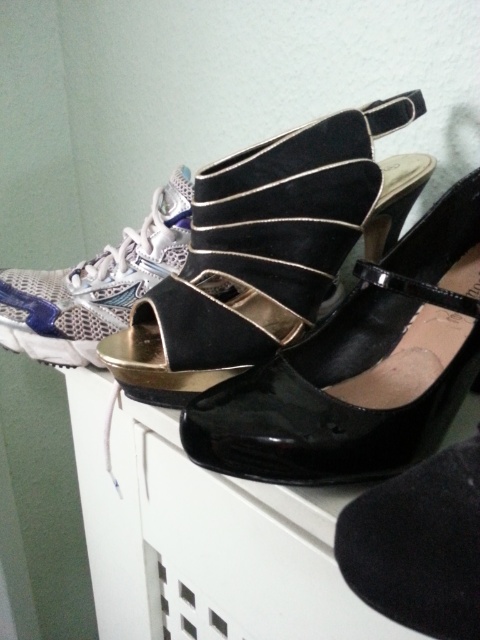
You are standing in front of the white cabinet with shoes displayed. There are two points marked on the image. The first point is at coordinate point (167, 284) and the second is at point (278, 376). Which point is closer to you?

Point (167, 284) is closer to you than point (278, 376) because it is further to the viewer according to the description.